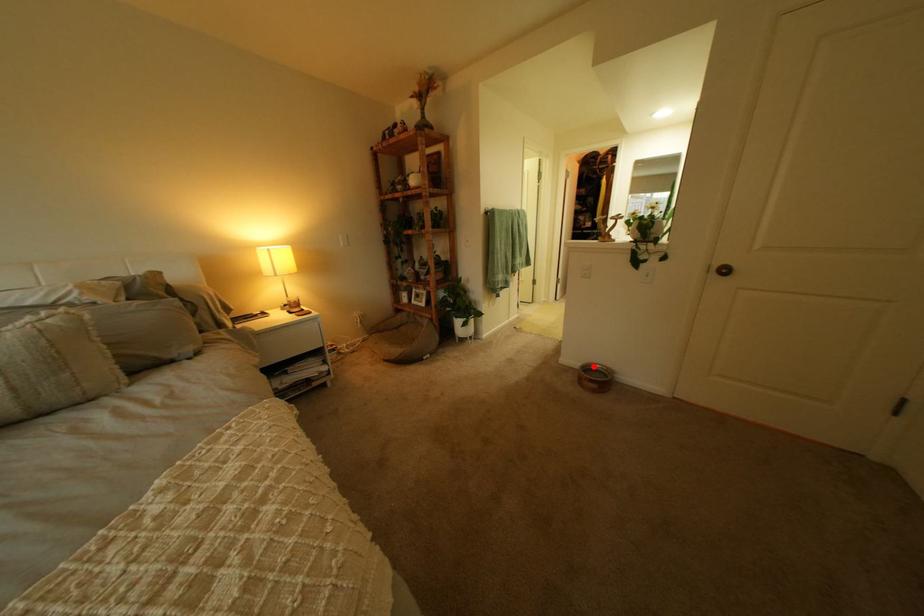
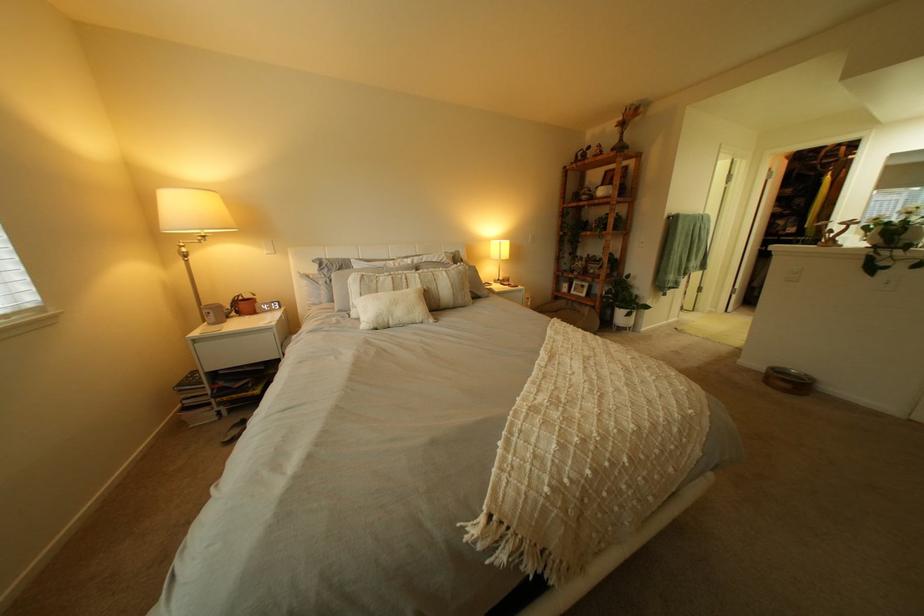
In the second image, find the point that corresponds to the highlighted location in the first image.

(779, 369)